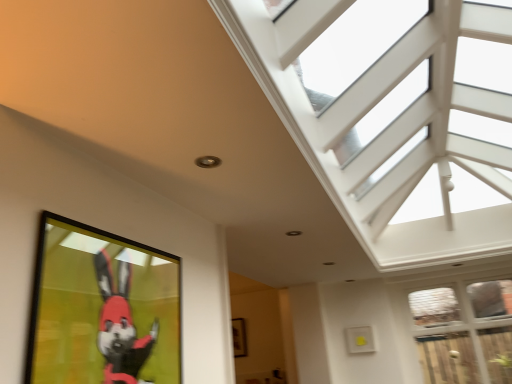
Question: In terms of width, does clear glass door at lower right, positioned as the second window in top-to-bottom order, look wider or thinner when compared to wooden picture frame at center, the 1th picture frame positioned from the back?

Choices:
 (A) wide
 (B) thin

Answer: (A)

Question: Is clear glass door at lower right, positioned as the second window in top-to-bottom order, taller or shorter than wooden picture frame at center, the 1th picture frame positioned from the back?

Choices:
 (A) short
 (B) tall

Answer: (B)

Question: Which is nearer to the matte black picture frame at lower left, placed as the 1th picture frame when sorted from front to back?

Choices:
 (A) wooden picture frame at center, the 1th picture frame positioned from the back
 (B) clear glass door at lower right, positioned as the second window in top-to-bottom order
 (C) white textured glass at upper right, which ranks as the 1th window in top-to-bottom order

Answer: (C)

Question: Estimate the real-world distances between objects in this image. Which object is farther from the white textured glass at upper right, the second window positioned from the bottom?

Choices:
 (A) clear glass door at lower right, the first window in the bottom-to-top sequence
 (B) matte black picture frame at lower left, positioned as the 2th picture frame in bottom-to-top order
 (C) wooden picture frame at center, marked as the second picture frame in a top-to-bottom arrangement

Answer: (C)